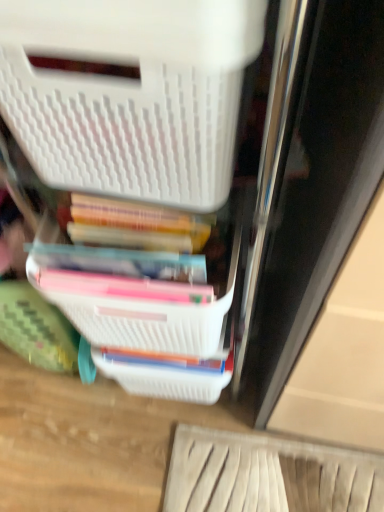
This screenshot has width=384, height=512. What do you see at coordinates (143, 320) in the screenshot?
I see `white plastic basket at center` at bounding box center [143, 320].

I want to click on white plastic basket at center, so click(143, 320).

Find the location of `white plastic storage box at upper left`. white plastic storage box at upper left is located at coordinates (131, 94).

Describe the element at coordinates (131, 94) in the screenshot. I see `white plastic storage box at upper left` at that location.

Measure the distance between point (60,75) and camera.

Point (60,75) is 13.70 inches away from camera.

Where is `white plastic basket at center`? The height and width of the screenshot is (512, 384). white plastic basket at center is located at coordinates (143, 320).

Which object is positioned more to the right, white plastic storage box at upper left or white plastic basket at center?

white plastic basket at center.

Which object is closer to the camera, white plastic storage box at upper left or white plastic basket at center?

white plastic storage box at upper left.

Which is in front, point (53, 30) or point (181, 341)?

Point (53, 30)

From the image's perspective, is white plastic storage box at upper left on top of white plastic basket at center?

Yes, from the image's perspective, white plastic storage box at upper left is above white plastic basket at center.

From a real-world perspective, is white plastic storage box at upper left positioned under white plastic basket at center based on gravity?

No, from a real-world perspective, white plastic storage box at upper left is not under white plastic basket at center.

Can you confirm if white plastic storage box at upper left is wider than white plastic basket at center?

Incorrect, the width of white plastic storage box at upper left does not surpass that of white plastic basket at center.

Does white plastic storage box at upper left have a lesser height compared to white plastic basket at center?

Incorrect, the height of white plastic storage box at upper left does not fall short of that of white plastic basket at center.

Can you confirm if white plastic storage box at upper left is smaller than white plastic basket at center?

Actually, white plastic storage box at upper left might be larger than white plastic basket at center.

Would you say white plastic storage box at upper left is inside or outside white plastic basket at center?

white plastic storage box at upper left is spatially situated outside white plastic basket at center.

Is white plastic storage box at upper left not close to white plastic basket at center?

No, white plastic storage box at upper left is not far away from white plastic basket at center.

Is white plastic storage box at upper left aimed at white plastic basket at center?

No, white plastic storage box at upper left is not turned towards white plastic basket at center.

How different are the orientations of white plastic storage box at upper left and white plastic basket at center in degrees?

The angle between the facing direction of white plastic storage box at upper left and the facing direction of white plastic basket at center is 0.00031 degrees.

Identify the location of storage box above the white plastic basket at center (from the image's perspective). The width and height of the screenshot is (384, 512). (131, 94).

Considering the relative positions of white plastic basket at center and white plastic storage box at upper left in the image provided, is white plastic basket at center to the left of white plastic storage box at upper left from the viewer's perspective?

No.

Which object is further away from the camera, white plastic basket at center or white plastic storage box at upper left?

white plastic basket at center is further away from the camera.

Which is behind, point (79, 314) or point (204, 193)?

Positioned behind is point (79, 314).

From the image's perspective, which one is positioned lower, white plastic basket at center or white plastic storage box at upper left?

white plastic basket at center is shown below in the image.

From a real-world perspective, who is located lower, white plastic basket at center or white plastic storage box at upper left?

white plastic basket at center, from a real-world perspective.

In the scene shown: Can you confirm if white plastic basket at center is thinner than white plastic storage box at upper left?

No, white plastic basket at center is not thinner than white plastic storage box at upper left.

Between white plastic basket at center and white plastic storage box at upper left, which one has less height?

Standing shorter between the two is white plastic basket at center.

Does white plastic basket at center have a smaller size compared to white plastic storage box at upper left?

Correct, white plastic basket at center occupies less space than white plastic storage box at upper left.

Is white plastic basket at center surrounding white plastic storage box at upper left?

No, white plastic storage box at upper left is located outside of white plastic basket at center.

Is the surface of white plastic basket at center in direct contact with white plastic storage box at upper left?

No.

Could you tell me if white plastic basket at center is turned towards white plastic storage box at upper left?

No.

Locate an element on the screen. The width and height of the screenshot is (384, 512). storage box located above the white plastic basket at center (from the image's perspective) is located at coordinates (131, 94).

What are the coordinates of `storage box above the white plastic basket at center (from a real-world perspective)` in the screenshot? It's located at [131, 94].

Identify the location of storage box located above the white plastic basket at center (from the image's perspective). (131, 94).